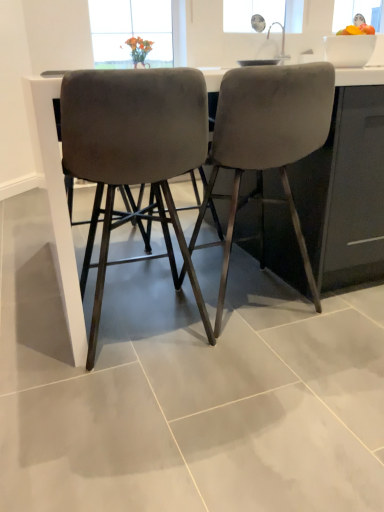
The height and width of the screenshot is (512, 384). What do you see at coordinates (134, 155) in the screenshot? I see `velvet grey chair at center, marked as the 2th chair in a right-to-left arrangement` at bounding box center [134, 155].

What do you see at coordinates (52, 183) in the screenshot? I see `satin gray barstools at center` at bounding box center [52, 183].

Measure the distance between velvet gray chair at center, which is the 1th chair in right-to-left order, and camera.

velvet gray chair at center, which is the 1th chair in right-to-left order, is 4.20 feet from camera.

You are a GUI agent. You are given a task and a screenshot of the screen. Output one action in this format:
    pyautogui.click(x=<x>, y=<y>)
    Task: Click on the velvet grey chair at center, marked as the 2th chair in a right-to-left arrangement
    This screenshot has height=512, width=384.
    Given the screenshot: What is the action you would take?
    pyautogui.click(x=134, y=155)

From a real-world perspective, does velvet grey chair at center, the first chair viewed from the left, stand above velvet gray chair at center, which is the 1th chair in right-to-left order?

Actually, velvet grey chair at center, the first chair viewed from the left, is physically below velvet gray chair at center, which is the 1th chair in right-to-left order, in the real world.

Considering the relative positions of velvet grey chair at center, marked as the 2th chair in a right-to-left arrangement, and velvet gray chair at center, which is the 2th chair from left to right, in the image provided, is velvet grey chair at center, marked as the 2th chair in a right-to-left arrangement, to the left of velvet gray chair at center, which is the 2th chair from left to right, from the viewer's perspective?

Correct, you'll find velvet grey chair at center, marked as the 2th chair in a right-to-left arrangement, to the left of velvet gray chair at center, which is the 2th chair from left to right.

Considering the sizes of objects velvet grey chair at center, marked as the 2th chair in a right-to-left arrangement, and velvet gray chair at center, which is the 2th chair from left to right, in the image provided, who is thinner, velvet grey chair at center, marked as the 2th chair in a right-to-left arrangement, or velvet gray chair at center, which is the 2th chair from left to right,?

velvet grey chair at center, marked as the 2th chair in a right-to-left arrangement, is thinner.

The image size is (384, 512). I want to click on chair located behind the velvet grey chair at center, marked as the 2th chair in a right-to-left arrangement, so click(x=266, y=144).

Is satin gray barstools at center far from velvet grey chair at center, marked as the 2th chair in a right-to-left arrangement?

No, satin gray barstools at center is not far from velvet grey chair at center, marked as the 2th chair in a right-to-left arrangement.

Is satin gray barstools at center situated inside velvet grey chair at center, marked as the 2th chair in a right-to-left arrangement, or outside?

satin gray barstools at center exists outside the volume of velvet grey chair at center, marked as the 2th chair in a right-to-left arrangement.

Could you tell me if satin gray barstools at center is turned towards velvet grey chair at center, the first chair viewed from the left?

Yes, satin gray barstools at center is aimed at velvet grey chair at center, the first chair viewed from the left.

Is point (59, 254) positioned in front of point (73, 126)?

No, it is not.

From the picture: How different are the orientations of velvet gray chair at center, which is the 1th chair in right-to-left order, and velvet grey chair at center, the first chair viewed from the left, in degrees?

0.000849 degrees.

Which of these two, velvet gray chair at center, which is the 1th chair in right-to-left order, or velvet grey chair at center, the first chair viewed from the left, is thinner?

velvet grey chair at center, the first chair viewed from the left.

Considering the relative sizes of velvet gray chair at center, which is the 2th chair from left to right, and velvet grey chair at center, the first chair viewed from the left, in the image provided, is velvet gray chair at center, which is the 2th chair from left to right, smaller than velvet grey chair at center, the first chair viewed from the left,?

No, velvet gray chair at center, which is the 2th chair from left to right, is not smaller than velvet grey chair at center, the first chair viewed from the left.

In terms of height, does velvet gray chair at center, which is the 1th chair in right-to-left order, look taller or shorter compared to velvet grey chair at center, marked as the 2th chair in a right-to-left arrangement?

In the image, velvet gray chair at center, which is the 1th chair in right-to-left order, appears to be taller than velvet grey chair at center, marked as the 2th chair in a right-to-left arrangement.

Between velvet gray chair at center, which is the 2th chair from left to right, and satin gray barstools at center, which one appears on the left side from the viewer's perspective?

velvet gray chair at center, which is the 2th chair from left to right, is more to the left.

Can you tell me how much velvet gray chair at center, which is the 2th chair from left to right, and satin gray barstools at center differ in facing direction?

They differ by 90.4 degrees in their facing directions.

Would you consider velvet gray chair at center, which is the 1th chair in right-to-left order, to be distant from satin gray barstools at center?

That's not correct — velvet gray chair at center, which is the 1th chair in right-to-left order, is a little close to satin gray barstools at center.

Is the surface of velvet grey chair at center, marked as the 2th chair in a right-to-left arrangement, in direct contact with satin gray barstools at center?

No, velvet grey chair at center, marked as the 2th chair in a right-to-left arrangement, is not with satin gray barstools at center.

Is velvet grey chair at center, marked as the 2th chair in a right-to-left arrangement, completely or partially outside of satin gray barstools at center?

No, velvet grey chair at center, marked as the 2th chair in a right-to-left arrangement, is not outside of satin gray barstools at center.

Is point (195, 85) in front of point (350, 75)?

Yes, point (195, 85) is closer to viewer.

From the picture: How distant is velvet grey chair at center, the first chair viewed from the left, from satin gray barstools at center?

velvet grey chair at center, the first chair viewed from the left, is 24.43 centimeters away from satin gray barstools at center.

Is point (73, 313) farther from viewer compared to point (236, 130)?

Yes.

From the image's perspective, which is above, satin gray barstools at center or velvet gray chair at center, which is the 2th chair from left to right?

satin gray barstools at center.

Considering the relative positions of satin gray barstools at center and velvet gray chair at center, which is the 2th chair from left to right, in the image provided, is satin gray barstools at center to the left or to the right of velvet gray chair at center, which is the 2th chair from left to right,?

From the image, it's evident that satin gray barstools at center is to the right of velvet gray chair at center, which is the 2th chair from left to right.

Based on the photo, how different are the orientations of satin gray barstools at center and velvet gray chair at center, which is the 2th chair from left to right, in degrees?

satin gray barstools at center and velvet gray chair at center, which is the 2th chair from left to right, are facing 90.4 degrees away from each other.

Locate an element on the screen. This screenshot has width=384, height=512. chair behind the velvet grey chair at center, marked as the 2th chair in a right-to-left arrangement is located at coordinates (266, 144).

I want to click on counter located on the right of velvet grey chair at center, the first chair viewed from the left, so click(52, 183).

When comparing their distances from velvet gray chair at center, which is the 1th chair in right-to-left order, does velvet grey chair at center, marked as the 2th chair in a right-to-left arrangement, or satin gray barstools at center seem further?

satin gray barstools at center is positioned further to the anchor velvet gray chair at center, which is the 1th chair in right-to-left order.

Which object lies further to the anchor point velvet gray chair at center, which is the 1th chair in right-to-left order, satin gray barstools at center or velvet grey chair at center, the first chair viewed from the left?

satin gray barstools at center.

From the image, which object appears to be nearer to velvet grey chair at center, the first chair viewed from the left, velvet gray chair at center, which is the 2th chair from left to right, or satin gray barstools at center?

satin gray barstools at center.

When comparing their distances from velvet grey chair at center, marked as the 2th chair in a right-to-left arrangement, does satin gray barstools at center or velvet gray chair at center, which is the 1th chair in right-to-left order, seem further?

Among the two, velvet gray chair at center, which is the 1th chair in right-to-left order, is located further to velvet grey chair at center, marked as the 2th chair in a right-to-left arrangement.

Estimate the real-world distances between objects in this image. Which object is further from satin gray barstools at center, velvet gray chair at center, which is the 1th chair in right-to-left order, or velvet grey chair at center, the first chair viewed from the left?

velvet gray chair at center, which is the 1th chair in right-to-left order, is further to satin gray barstools at center.

Considering their positions, is velvet grey chair at center, the first chair viewed from the left, positioned further to satin gray barstools at center than velvet gray chair at center, which is the 1th chair in right-to-left order?

velvet gray chair at center, which is the 1th chair in right-to-left order, is further to satin gray barstools at center.

At what (x,y) coordinates should I click in order to perform the action: click on chair located between velvet grey chair at center, marked as the 2th chair in a right-to-left arrangement, and satin gray barstools at center in the left-right direction. Please return your answer as a coordinate pair (x, y). The image size is (384, 512). Looking at the image, I should click on (266, 144).